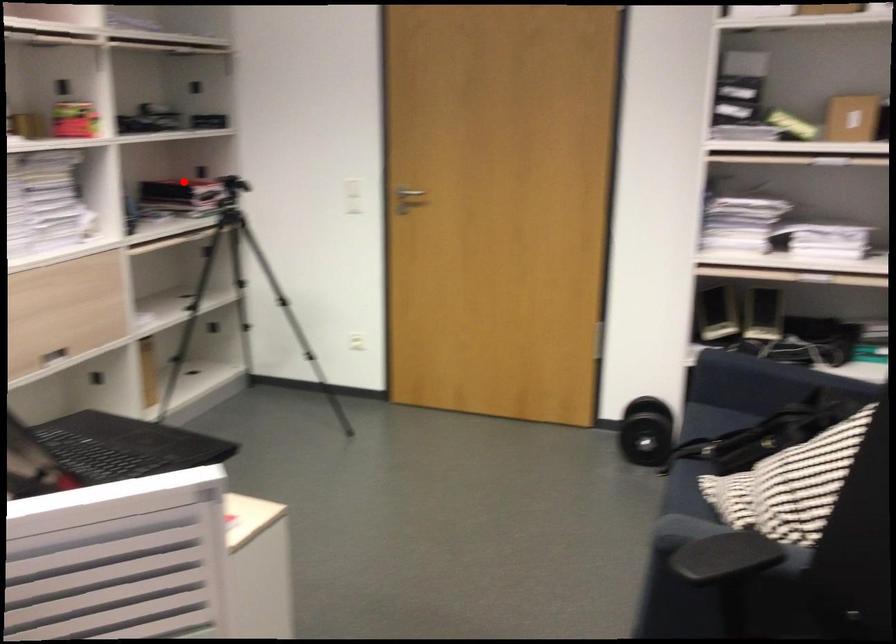
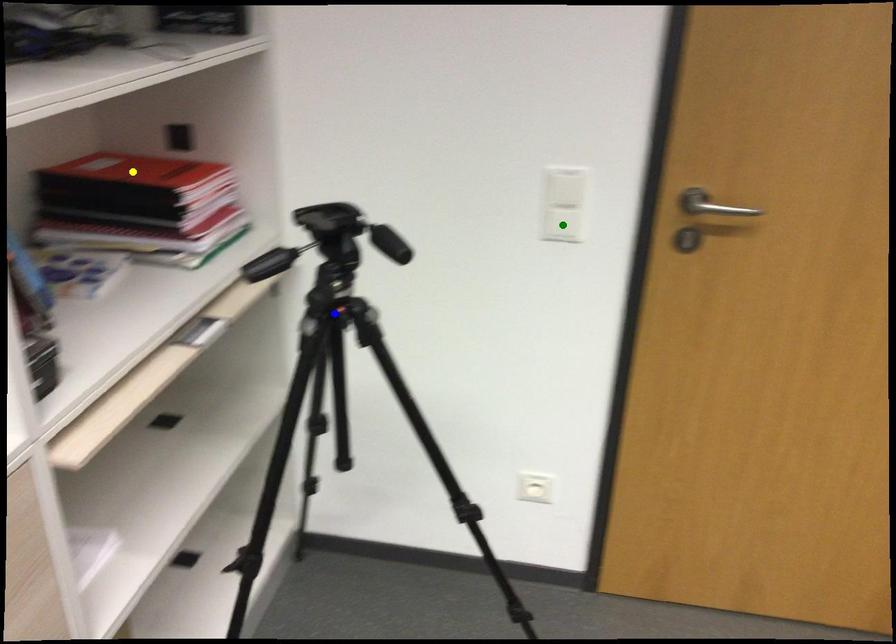
Question: I am providing you with two images of the same scene from different viewpoints. A red point is marked on the first image. You are given multiple points on the second image. Which mark in image 2 goes with the point in image 1?

Choices:
 (A) green point
 (B) blue point
 (C) yellow point

Answer: (C)